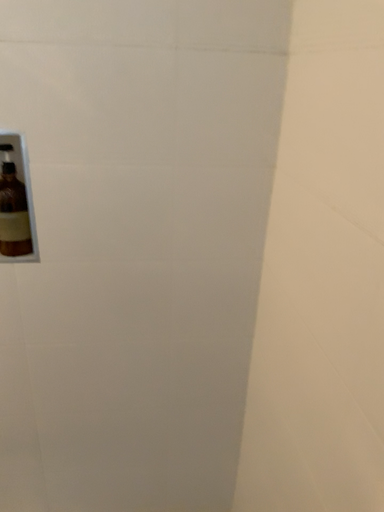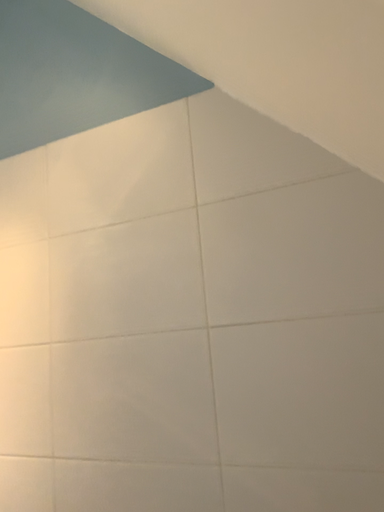
Question: Which way did the camera rotate in the video?

Choices:
 (A) rotated right
 (B) rotated left

Answer: (B)